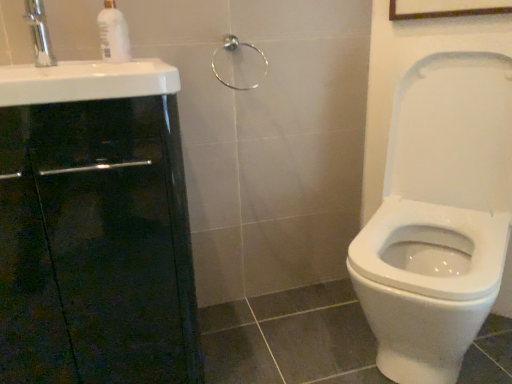
Question: Does satin nickel towel ring at upper center have a greater height compared to black glossy cabinet at left?

Choices:
 (A) yes
 (B) no

Answer: (B)

Question: Does satin nickel towel ring at upper center have a lesser height compared to black glossy cabinet at left?

Choices:
 (A) no
 (B) yes

Answer: (B)

Question: From the image's perspective, would you say satin nickel towel ring at upper center is positioned over black glossy cabinet at left?

Choices:
 (A) no
 (B) yes

Answer: (B)

Question: Can you confirm if satin nickel towel ring at upper center is wider than black glossy cabinet at left?

Choices:
 (A) yes
 (B) no

Answer: (B)

Question: Is satin nickel towel ring at upper center facing away from black glossy cabinet at left?

Choices:
 (A) yes
 (B) no

Answer: (B)

Question: From a real-world perspective, is black glossy cabinet at left physically located above or below silver metallic faucet at upper left?

Choices:
 (A) above
 (B) below

Answer: (B)

Question: Does point (84, 382) appear closer or farther from the camera than point (46, 31)?

Choices:
 (A) farther
 (B) closer

Answer: (B)

Question: Would you say black glossy cabinet at left is to the left or to the right of silver metallic faucet at upper left in the picture?

Choices:
 (A) left
 (B) right

Answer: (B)

Question: Relative to silver metallic faucet at upper left, is black glossy cabinet at left in front or behind?

Choices:
 (A) behind
 (B) front

Answer: (B)

Question: Is point (112, 57) closer or farther from the camera than point (96, 61)?

Choices:
 (A) closer
 (B) farther

Answer: (A)

Question: Is white glossy soap dispenser at upper left taller or shorter than white glossy sink at left?

Choices:
 (A) short
 (B) tall

Answer: (B)

Question: From the image's perspective, is white glossy soap dispenser at upper left above or below white glossy sink at left?

Choices:
 (A) above
 (B) below

Answer: (A)

Question: Relative to white glossy sink at left, is white glossy soap dispenser at upper left in front or behind?

Choices:
 (A) behind
 (B) front

Answer: (A)

Question: From the image's perspective, is white glossy sink at left above or below silver metallic faucet at upper left?

Choices:
 (A) above
 (B) below

Answer: (B)

Question: Does point (150, 94) appear closer or farther from the camera than point (44, 21)?

Choices:
 (A) farther
 (B) closer

Answer: (B)